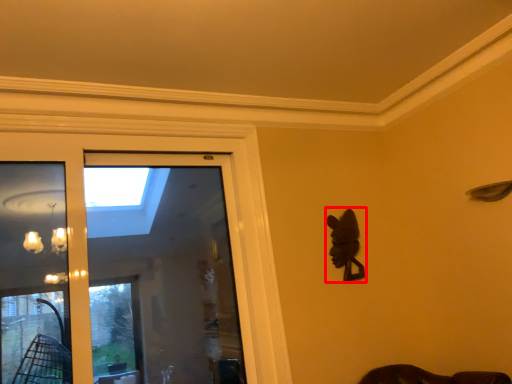
Question: From the image's perspective, where is animal (annotated by the red box) located relative to screen door?

Choices:
 (A) below
 (B) above

Answer: (B)